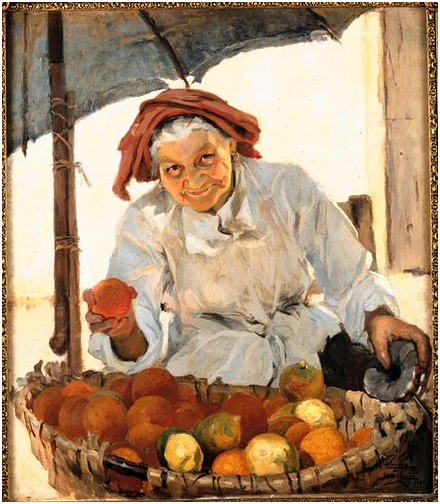
This screenshot has width=440, height=504. What are the coordinates of `basket` in the screenshot? It's located at (352, 470).